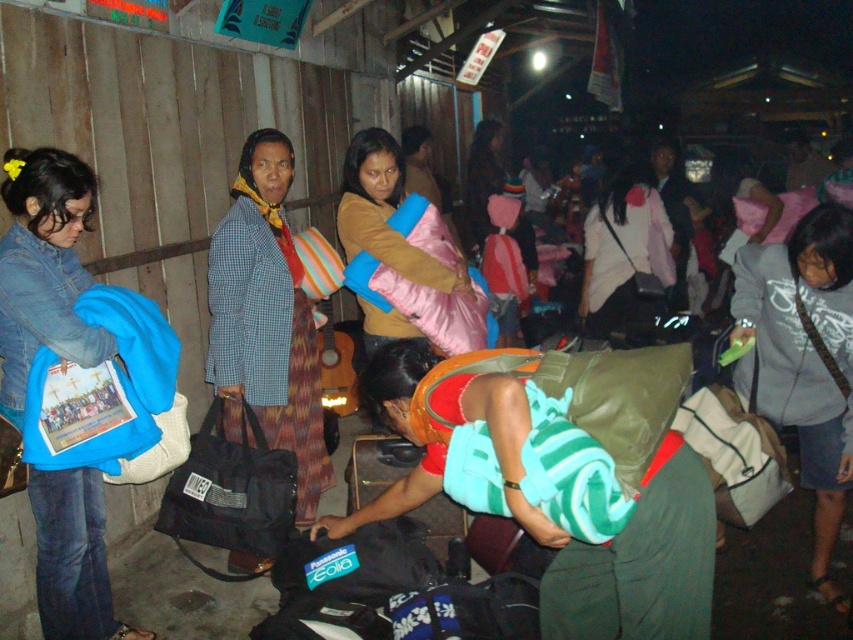
Question: Based on their relative distances, which object is farther from the black fabric bag at center?

Choices:
 (A) denim jacket at left
 (B) white fabric bag at lower right
 (C) teal fabric bag at center

Answer: (A)

Question: Which point appears closest to the camera in this image?

Choices:
 (A) (751, 451)
 (B) (91, 598)
 (C) (404, 340)

Answer: (C)

Question: Which point is farther to the camera?

Choices:
 (A) (370, 454)
 (B) (662, 496)
 (C) (759, 506)

Answer: (A)

Question: Can you confirm if teal fabric bag at center is wider than black fabric bag at center?

Choices:
 (A) no
 (B) yes

Answer: (B)

Question: Is denim jacket at left bigger than gray cotton hoodie at lower right?

Choices:
 (A) no
 (B) yes

Answer: (A)

Question: Is black fabric bag at lower left below pink fabric bag at center?

Choices:
 (A) no
 (B) yes

Answer: (B)